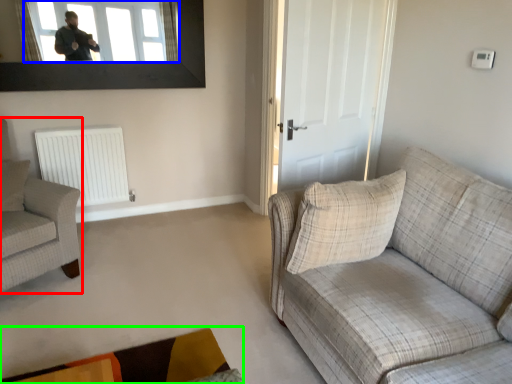
Question: Considering the real-world distances, which object is closest to chair (highlighted by a red box)? window (highlighted by a blue box) or plain (highlighted by a green box).

Choices:
 (A) window
 (B) plain

Answer: (B)